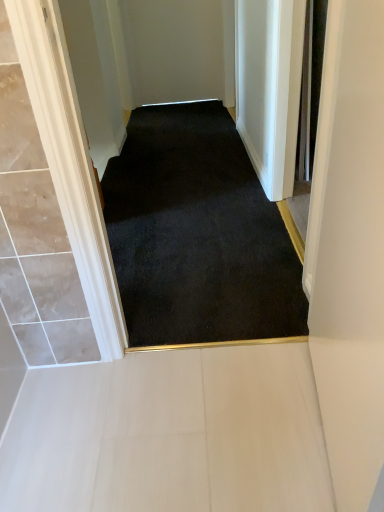
What do you see at coordinates (349, 249) in the screenshot? I see `matte white door at right` at bounding box center [349, 249].

This screenshot has width=384, height=512. What are the coordinates of `black carpet at center` in the screenshot? It's located at (197, 234).

What do you see at coordinates (197, 234) in the screenshot?
I see `black carpet at center` at bounding box center [197, 234].

Locate an element on the screen. Image resolution: width=384 pixels, height=512 pixels. white tile floor at lower center is located at coordinates (170, 434).

The width and height of the screenshot is (384, 512). In order to click on door on the right of white tile floor at lower center in this screenshot , I will do `click(349, 249)`.

Considering the relative positions of white tile floor at lower center and matte white door at right in the image provided, is white tile floor at lower center to the right of matte white door at right from the viewer's perspective?

No.

Who is bigger, white tile floor at lower center or matte white door at right?

With larger size is matte white door at right.

Is matte white door at right in front of or behind white tile floor at lower center in the image?

matte white door at right is positioned closer to the viewer than white tile floor at lower center.

From the image's perspective, is matte white door at right positioned above or below white tile floor at lower center?

From the image's perspective, matte white door at right appears above white tile floor at lower center.

Considering the relative sizes of matte white door at right and white tile floor at lower center in the image provided, is matte white door at right bigger than white tile floor at lower center?

Correct, matte white door at right is larger in size than white tile floor at lower center.

From the picture: Is matte white door at right beside white tile floor at lower center?

No, matte white door at right is not beside white tile floor at lower center.

Is black carpet at center thinner than white tile floor at lower center?

Incorrect, the width of black carpet at center is not less than that of white tile floor at lower center.

Does black carpet at center have a larger size compared to white tile floor at lower center?

Correct, black carpet at center is larger in size than white tile floor at lower center.

Could white tile floor at lower center be considered to be inside black carpet at center?

Definitely not — white tile floor at lower center is not inside black carpet at center.

Is black carpet at center placed right next to white tile floor at lower center?

No, black carpet at center is not beside white tile floor at lower center.

Does white tile floor at lower center have a lesser width compared to black carpet at center?

Indeed, white tile floor at lower center has a lesser width compared to black carpet at center.

From the picture: From the image's perspective, between white tile floor at lower center and black carpet at center, which one is located above?

black carpet at center appears higher in the image.

I want to click on doormat that appears on the right of white tile floor at lower center, so click(197, 234).

Is white tile floor at lower center not within black carpet at center?

Yes, white tile floor at lower center is not within black carpet at center.

Between matte white door at right and black carpet at center, which one has larger size?

black carpet at center is bigger.

Considering the positions of objects matte white door at right and black carpet at center in the image provided, who is in front, matte white door at right or black carpet at center?

matte white door at right is more forward.

From the image's perspective, is matte white door at right located above or below black carpet at center?

Based on their image positions, matte white door at right is located beneath black carpet at center.

Between black carpet at center and matte white door at right, which one has smaller size?

With smaller size is matte white door at right.

Identify the location of door in front of the black carpet at center. This screenshot has height=512, width=384. click(349, 249).

From the image's perspective, relative to matte white door at right, is black carpet at center above or below?

Clearly, from the image's perspective, black carpet at center is above matte white door at right.

Which is more to the right, black carpet at center or matte white door at right?

Positioned to the right is matte white door at right.

I want to click on path that appears behind the matte white door at right, so click(170, 434).

At what (x,y) coordinates should I click in order to perform the action: click on door positioned vertically above the white tile floor at lower center (from a real-world perspective). Please return your answer as a coordinate pair (x, y). Looking at the image, I should click on (349, 249).

Which object lies further to the anchor point white tile floor at lower center, matte white door at right or black carpet at center?

Among the two, black carpet at center is located further to white tile floor at lower center.

Which object lies nearer to the anchor point black carpet at center, white tile floor at lower center or matte white door at right?

The object closer to black carpet at center is white tile floor at lower center.

From the image, which object appears to be nearer to white tile floor at lower center, black carpet at center or matte white door at right?

The object closer to white tile floor at lower center is matte white door at right.

Which object lies further to the anchor point matte white door at right, black carpet at center or white tile floor at lower center?

Among the two, black carpet at center is located further to matte white door at right.

When comparing their distances from matte white door at right, does white tile floor at lower center or black carpet at center seem closer?

The object closer to matte white door at right is white tile floor at lower center.

From the image, which object appears to be nearer to black carpet at center, matte white door at right or white tile floor at lower center?

white tile floor at lower center is positioned closer to the anchor black carpet at center.

You are a GUI agent. You are given a task and a screenshot of the screen. Output one action in this format:
    pyautogui.click(x=<x>, y=<y>)
    Task: Click on the path between matte white door at right and black carpet at center along the z-axis
    The image size is (384, 512).
    Given the screenshot: What is the action you would take?
    pyautogui.click(x=170, y=434)